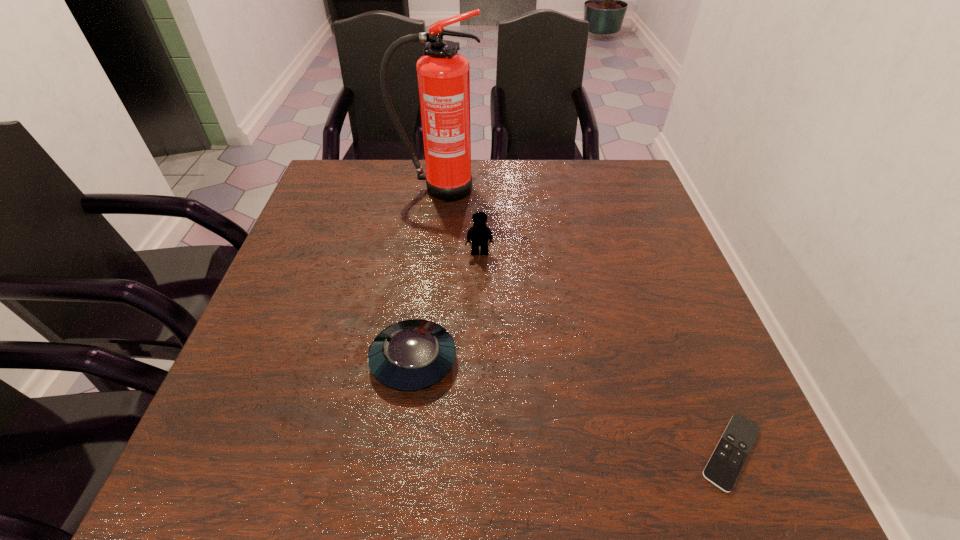
This screenshot has width=960, height=540. I want to click on free space located on the back of the saucer, so click(x=420, y=302).

Identify the location of free space located 0.150m on the back of the nearest object. [688, 346].

This screenshot has width=960, height=540. In order to click on object located in the far edge section of the desktop in this screenshot , I will do `click(443, 75)`.

At what (x,y) coordinates should I click in order to perform the action: click on object located at the near edge. Please return your answer as a coordinate pair (x, y). Looking at the image, I should click on (724, 466).

This screenshot has width=960, height=540. I want to click on object that is at the right edge, so click(x=724, y=466).

The image size is (960, 540). In order to click on object that is at the near right corner in this screenshot , I will do `click(724, 466)`.

Where is `vacant space at the far edge`? This screenshot has height=540, width=960. vacant space at the far edge is located at coordinates (540, 167).

In the image, there is a desktop. At what (x,y) coordinates should I click in order to perform the action: click on free region at the near edge. Please return your answer as a coordinate pair (x, y). The width and height of the screenshot is (960, 540). Looking at the image, I should click on (636, 451).

Locate an element on the screen. The image size is (960, 540). vacant position at the left edge of the desktop is located at coordinates (305, 350).

You are a GUI agent. You are given a task and a screenshot of the screen. Output one action in this format:
    pyautogui.click(x=<x>, y=<y>)
    Task: Click on the vacant space at the right edge of the desktop
    Image resolution: width=960 pixels, height=540 pixels.
    Given the screenshot: What is the action you would take?
    pyautogui.click(x=675, y=289)